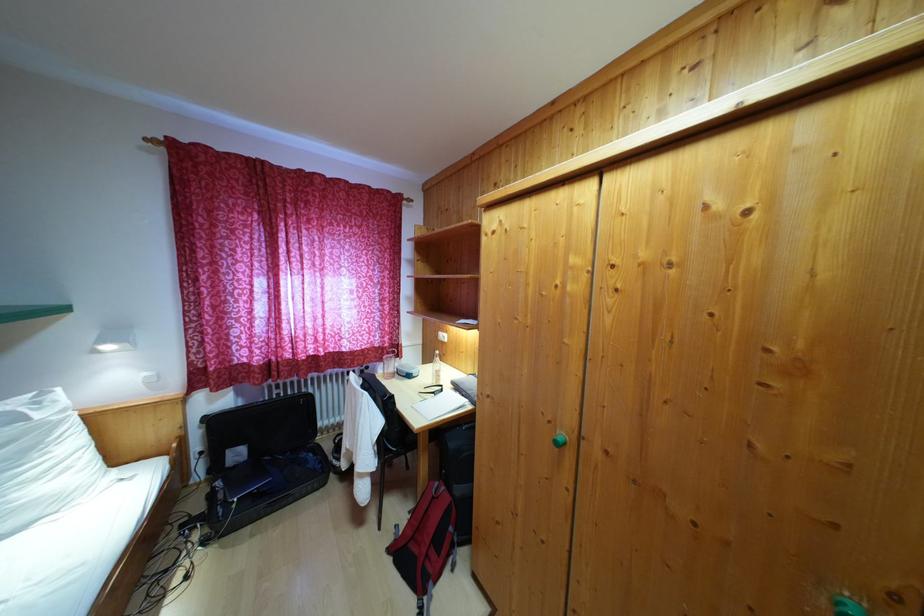
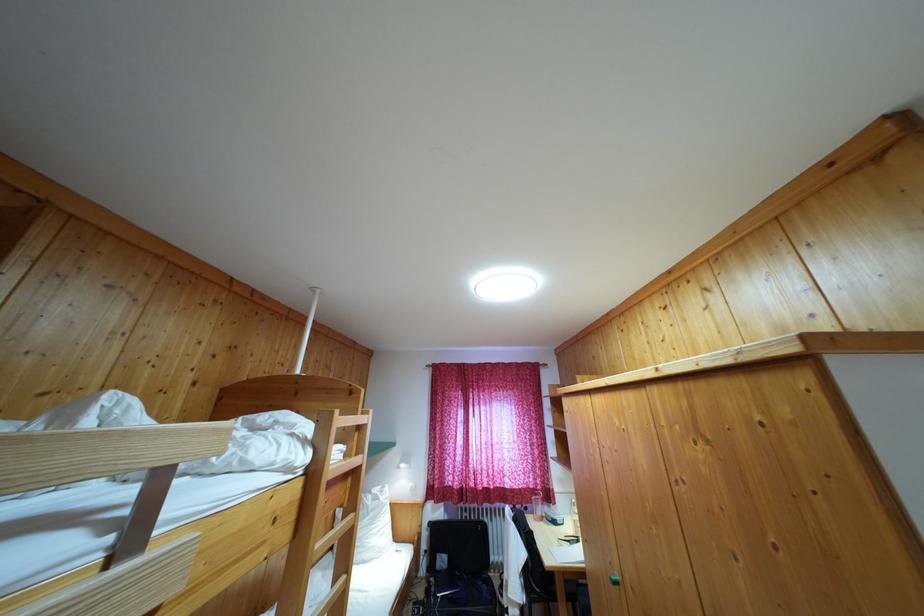
Locate, in the second image, the point that corresponds to pixel 241 461 in the first image.

(445, 567)